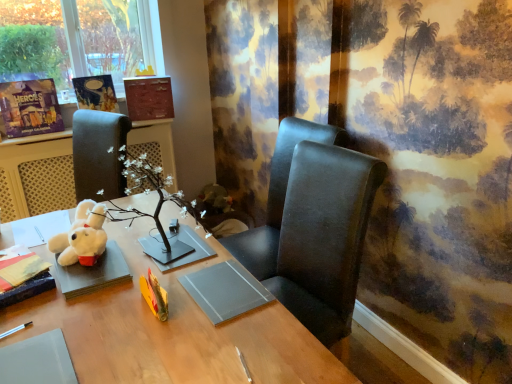
Identify the location of free space above matte black book at lower left, acting as the 4th book starting from the back (from a real-world perspective). The height and width of the screenshot is (384, 512). (19, 264).